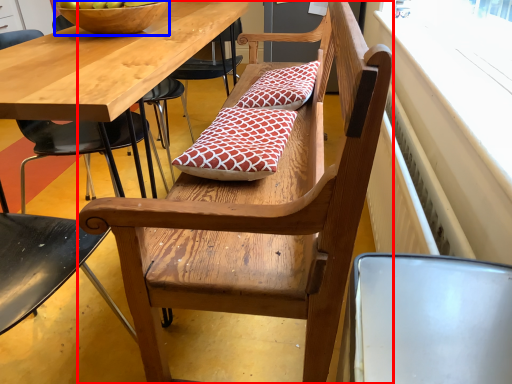
Question: Which of the following is the closest to the observer, bench (highlighted by a red box) or bowl (highlighted by a blue box)?

Choices:
 (A) bench
 (B) bowl

Answer: (A)